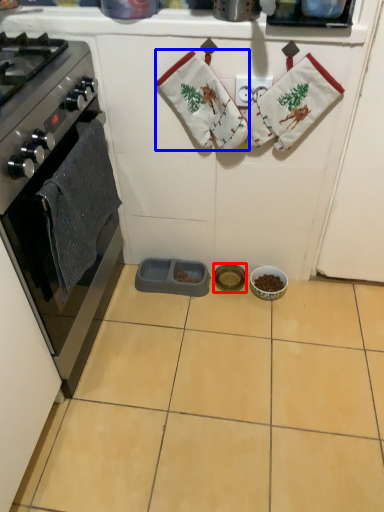
Question: Which object appears closest to the camera in this image, appliance (highlighted by a red box) or hand towel (highlighted by a blue box)?

Choices:
 (A) appliance
 (B) hand towel

Answer: (B)